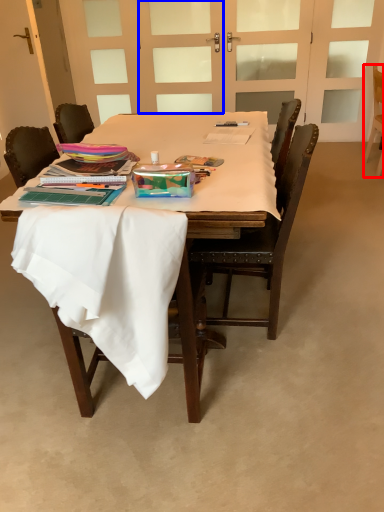
Question: Which point is closer to the camera, chair (highlighted by a red box) or screen door (highlighted by a blue box)?

Choices:
 (A) chair
 (B) screen door

Answer: (A)